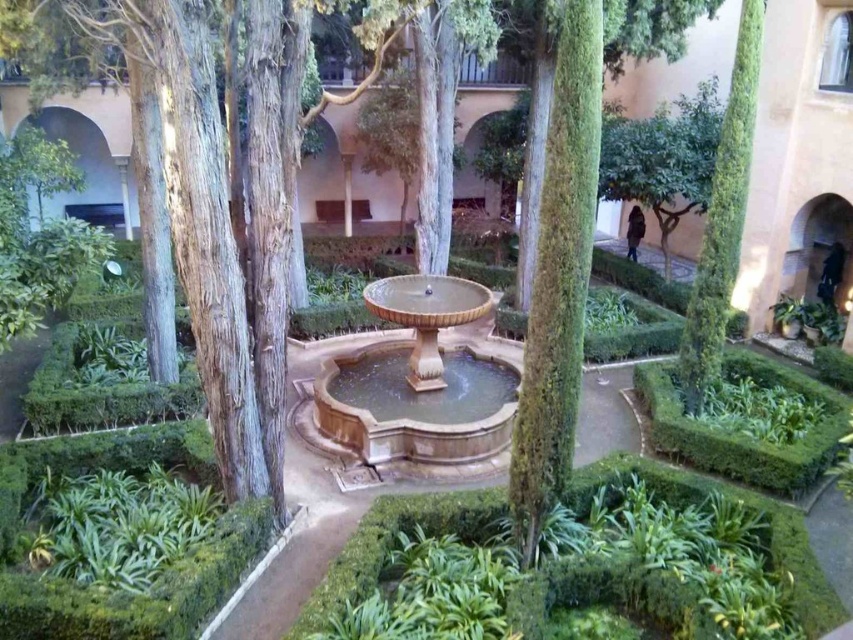
You are a visitor in the courtyard garden and want to take a photo of both the brown stone fountain at center and the green leafy tree at right. Which object should you position closer to the camera to ensure both are in focus?

The brown stone fountain at center is shorter than the green leafy tree at right, so positioning the camera closer to the brown stone fountain at center will help keep both in focus as they will be at a similar distance from the camera.

You are standing in the courtyard garden and want to locate the brown stone fountain at center. Based on the coordinates provided, in which direction should you move relative to your current position at point 0.3, 0.5?

The brown stone fountain at center is located at coordinates [418,376]. Since you are at [426,192], you should move to the right to reach it.

You are a landscape architect designing a new garden. You need to place a decorative statue that requires a space wider than the green leafy tree at right. Can the brown stone fountain at center accommodate this statue? Please explain based on their widths.

The brown stone fountain at center is wider than the green leafy tree at right. Therefore, the brown stone fountain at center can accommodate the statue requiring a space wider than the green leafy tree at right.